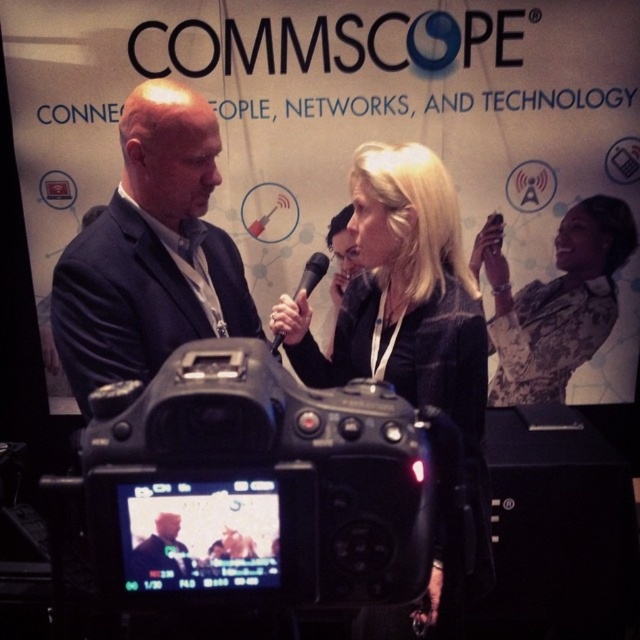
You are attending a professional event and notice two attendees wearing a black fabric jacket at center and a patterned fabric dress at upper right. Which clothing item is closer to the camera?

The black fabric jacket at center is positioned under the patterned fabric dress at upper right, meaning it is closer to the camera since it is lower in the frame.

You are a photographer at the event and need to adjust the camera focus. The patterned fabric dress at upper right and the black matte microphone at center are both in the frame. Which object should you focus on first if you want to prioritize the larger one?

The patterned fabric dress at upper right is bigger than the black matte microphone at center, so you should focus on the patterned fabric dress at upper right first.